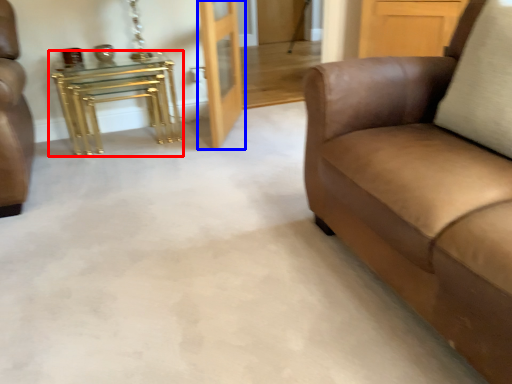
Question: Among these objects, which one is nearest to the camera, table (highlighted by a red box) or door (highlighted by a blue box)?

Choices:
 (A) table
 (B) door

Answer: (B)